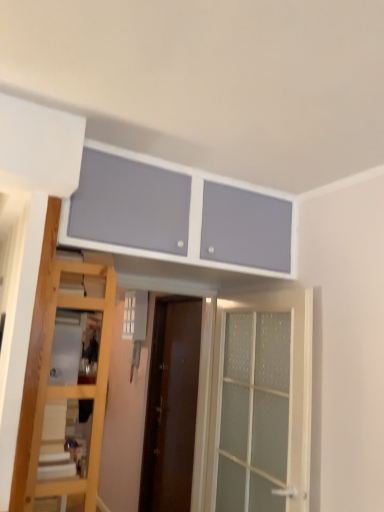
Question: Can you confirm if wooden ladder at lower left is wider than matte white cabinet at upper center?

Choices:
 (A) no
 (B) yes

Answer: (A)

Question: Can you confirm if wooden ladder at lower left is positioned to the left of matte white cabinet at upper center?

Choices:
 (A) yes
 (B) no

Answer: (A)

Question: Is wooden ladder at lower left thinner than matte white cabinet at upper center?

Choices:
 (A) yes
 (B) no

Answer: (A)

Question: Considering the relative sizes of wooden ladder at lower left and matte white cabinet at upper center in the image provided, is wooden ladder at lower left bigger than matte white cabinet at upper center?

Choices:
 (A) no
 (B) yes

Answer: (A)

Question: Considering the relative positions of wooden ladder at lower left and matte white cabinet at upper center in the image provided, is wooden ladder at lower left to the right of matte white cabinet at upper center from the viewer's perspective?

Choices:
 (A) yes
 (B) no

Answer: (B)

Question: From the image's perspective, is wooden ladder at lower left on matte white cabinet at upper center?

Choices:
 (A) yes
 (B) no

Answer: (B)

Question: Is brown wooden door at center, placed as the first door when sorted from back to front, wider than matte white cabinet at upper center?

Choices:
 (A) yes
 (B) no

Answer: (B)

Question: Is brown wooden door at center, placed as the first door when sorted from back to front, shorter than matte white cabinet at upper center?

Choices:
 (A) no
 (B) yes

Answer: (A)

Question: Is brown wooden door at center, positioned as the second door in front-to-back order, outside of matte white cabinet at upper center?

Choices:
 (A) yes
 (B) no

Answer: (A)

Question: Does brown wooden door at center, positioned as the second door in front-to-back order, appear on the left side of matte white cabinet at upper center?

Choices:
 (A) yes
 (B) no

Answer: (A)

Question: From the image's perspective, is brown wooden door at center, the 2th door from the right, located beneath matte white cabinet at upper center?

Choices:
 (A) no
 (B) yes

Answer: (B)

Question: Is brown wooden door at center, the 2th door from the right, facing away from matte white cabinet at upper center?

Choices:
 (A) no
 (B) yes

Answer: (A)

Question: From a real-world perspective, is matte white cabinet at upper center beneath clear glass door at center, which is counted as the 2th door, starting from the left?

Choices:
 (A) yes
 (B) no

Answer: (B)